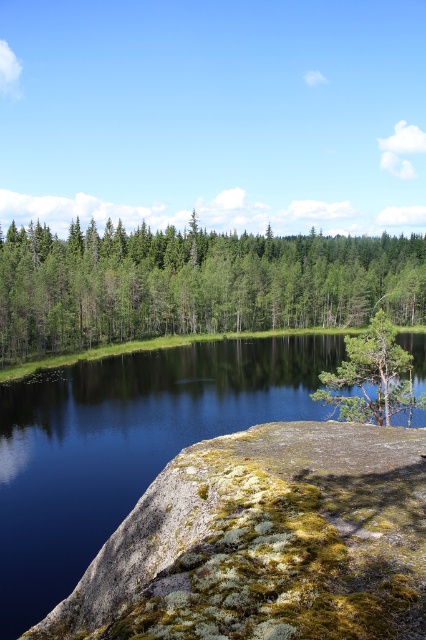
Question: Among these objects, which one is farthest from the camera?

Choices:
 (A) green matte tree at center
 (B) green textured tree at center
 (C) smooth dark water at center

Answer: (B)

Question: Is smooth dark water at center wider than green matte tree at center?

Choices:
 (A) no
 (B) yes

Answer: (B)

Question: Is smooth dark water at center positioned before green textured tree at center?

Choices:
 (A) yes
 (B) no

Answer: (A)

Question: Which of these objects is positioned farthest from the green textured tree at center?

Choices:
 (A) smooth dark water at center
 (B) green matte tree at center

Answer: (B)

Question: Which of these objects is positioned closest to the smooth dark water at center?

Choices:
 (A) green textured tree at center
 (B) green matte tree at center

Answer: (B)

Question: Can you confirm if green textured tree at center is positioned below green matte tree at center?

Choices:
 (A) yes
 (B) no

Answer: (B)